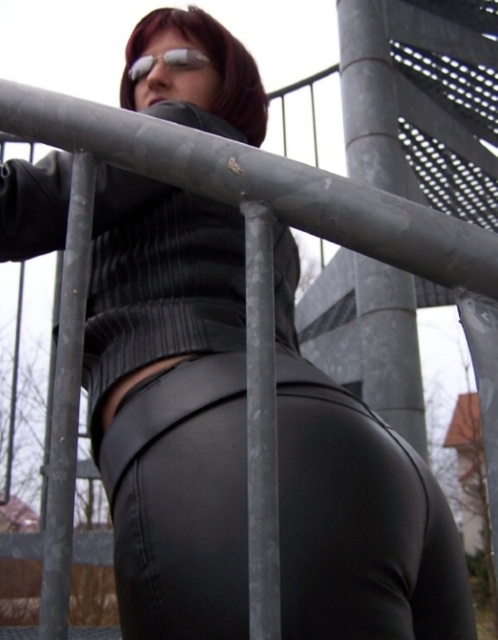
Based on the coordinates provided, what object is located at the point marked as point (x=360, y=522) in the image?

The point (x=360, y=522) marks the black leather leggings at center.

Based on the photo, you are a fashion designer analyzing the outfit of the person in the image. You need to determine if the black leather leggings at center can be paired with the shiny silver goggles at upper center based on their size. Which item is wider?

The black leather leggings at center might be wider than shiny silver goggles at upper center, so they can be paired together as the leggings are wider and won

You are a photographer setting up a shot of the person leaning against the railing. You need to decide which pole to focus on first. Which pole is closer to you, the metallic gray pole at center or the gray textured pole at center?

The metallic gray pole at center is closer to you than the gray textured pole at center.